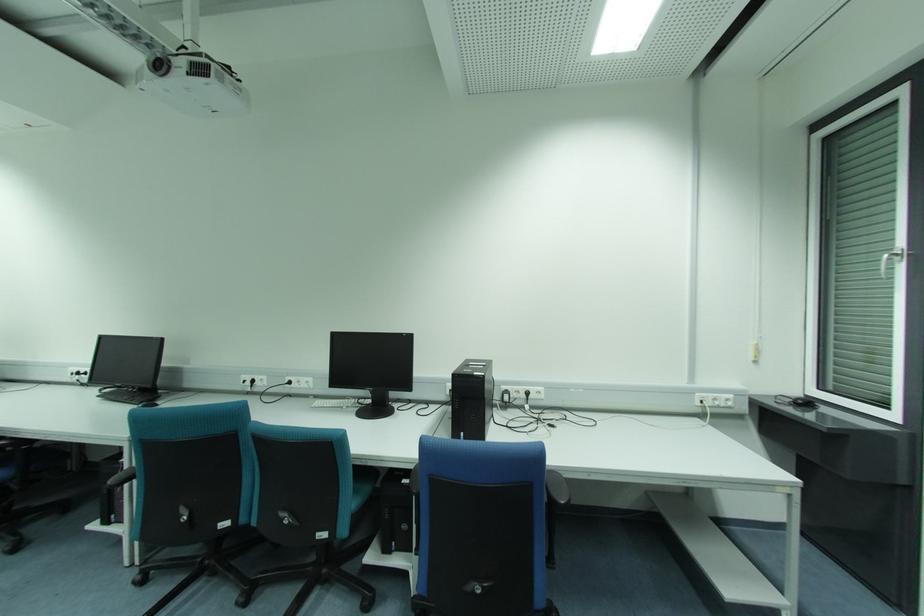
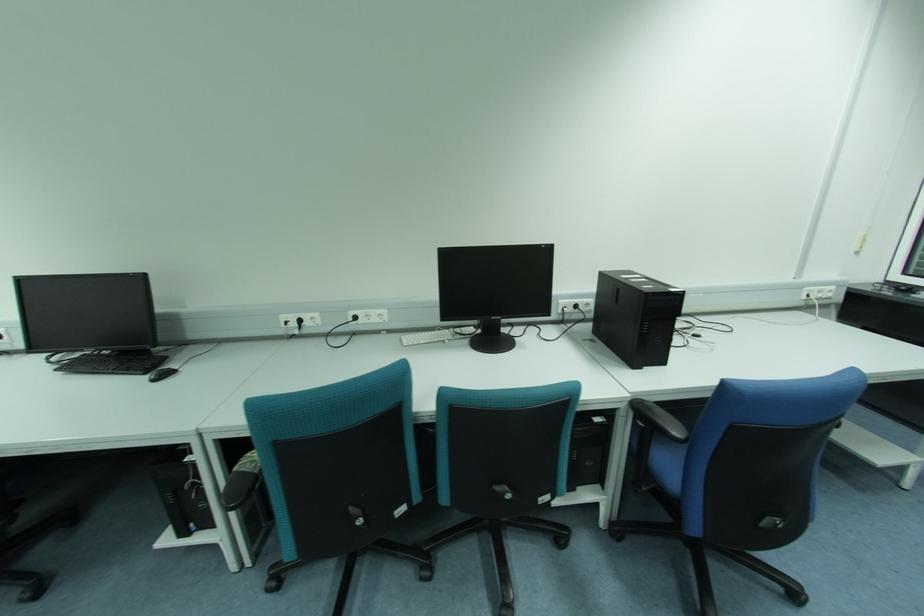
The point at (100, 397) is marked in the first image. Where is the corresponding point in the second image?

(58, 370)